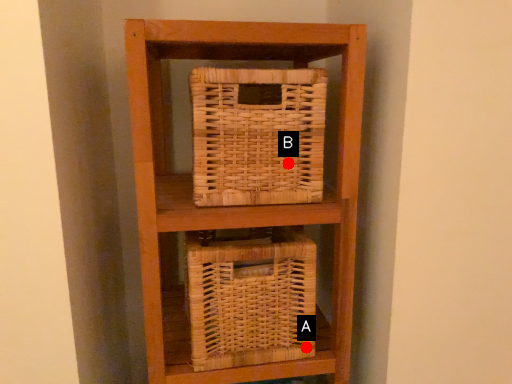
Question: Two points are circled on the image, labeled by A and B beside each circle. Which point is closer to the camera taking this photo?

Choices:
 (A) A is closer
 (B) B is closer

Answer: (B)